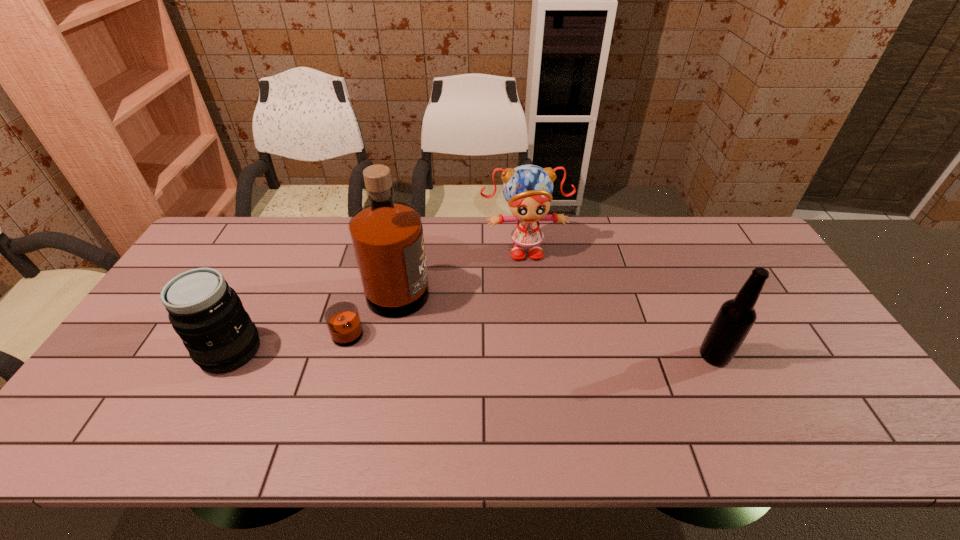
In the image, there is a desktop. In order to click on vacant region at the far left corner in this screenshot , I will do [x=204, y=248].

The image size is (960, 540). What are the coordinates of `vacant space at the far right corner of the desktop` in the screenshot? It's located at (706, 234).

Where is `free location at the near right corner of the desktop`? This screenshot has height=540, width=960. free location at the near right corner of the desktop is located at coordinates (862, 388).

I want to click on blank region between the shortest object and the beer bottle, so click(472, 354).

You are a GUI agent. You are given a task and a screenshot of the screen. Output one action in this format:
    pyautogui.click(x=<x>, y=<y>)
    Task: Click on the free spot between the liquor and the rightmost object
    This screenshot has height=540, width=960.
    Given the screenshot: What is the action you would take?
    pyautogui.click(x=549, y=332)

At what (x,y) coordinates should I click in order to perform the action: click on vacant area that lies between the beer bottle and the liquor. Please return your answer as a coordinate pair (x, y). The height and width of the screenshot is (540, 960). Looking at the image, I should click on (549, 332).

Identify the location of free point between the beer bottle and the liquor. This screenshot has height=540, width=960. (549, 332).

Image resolution: width=960 pixels, height=540 pixels. Identify the location of free space that is in between the farthest object and the tallest object. (454, 278).

This screenshot has height=540, width=960. I want to click on vacant region between the doll and the beer bottle, so click(619, 302).

At what (x,y) coordinates should I click in order to perform the action: click on free space between the third object from left to right and the rightmost object. Please return your answer as a coordinate pair (x, y). The height and width of the screenshot is (540, 960). Looking at the image, I should click on (619, 302).